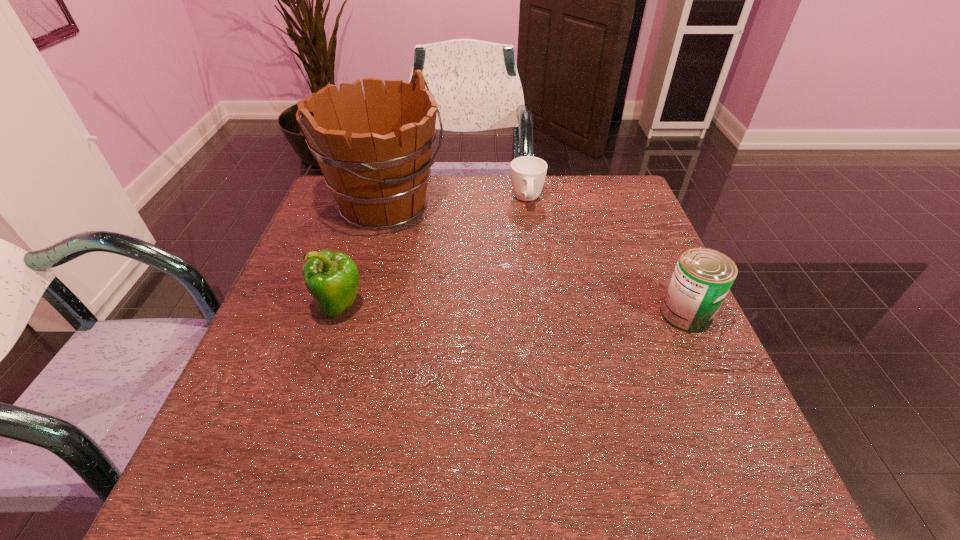
Identify the location of vacant area that lies between the shortest object and the rightmost object. Image resolution: width=960 pixels, height=540 pixels. (607, 257).

This screenshot has width=960, height=540. Identify the location of free spot between the second object from right to left and the rightmost object. (607, 257).

Locate an element on the screen. vacant space that's between the bell pepper and the wine bucket is located at coordinates (363, 257).

Image resolution: width=960 pixels, height=540 pixels. I want to click on empty location between the third tallest object and the tallest object, so click(536, 260).

The height and width of the screenshot is (540, 960). I want to click on empty location between the wine bucket and the can, so click(536, 260).

This screenshot has height=540, width=960. Find the location of `empty space that is in between the can and the tallest object`. empty space that is in between the can and the tallest object is located at coordinates (536, 260).

Find the location of a particular element. The image size is (960, 540). vacant space that's between the wine bucket and the bell pepper is located at coordinates (363, 257).

Identify which object is located as the second nearest to the cup. Please provide its 2D coordinates. Your answer should be formatted as a tuple, i.e. [(x, y)], where the tuple contains the x and y coordinates of a point satisfying the conditions above.

[(702, 278)]

Select which object is the second closest to the rightmost object. Please provide its 2D coordinates. Your answer should be formatted as a tuple, i.e. [(x, y)], where the tuple contains the x and y coordinates of a point satisfying the conditions above.

[(379, 180)]

The image size is (960, 540). What are the coordinates of `free space that satisfies the following two spatial constraints: 1. on the back side of the cup; 2. on the right side of the tallest object` in the screenshot? It's located at 387,201.